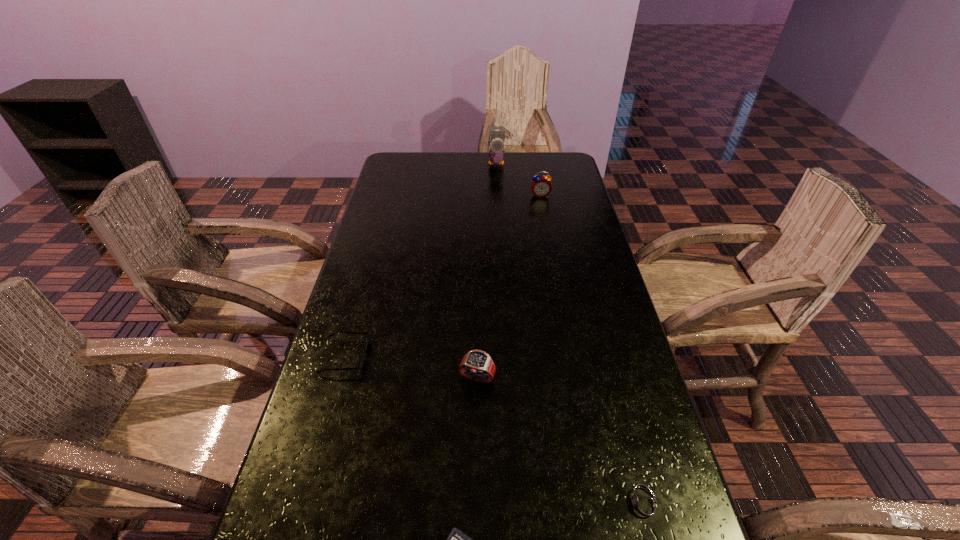
The height and width of the screenshot is (540, 960). Identify the location of watch that is at the right edge. (642, 504).

Find the location of a particular element. This screenshot has height=540, width=960. vacant point at the far edge is located at coordinates (513, 172).

Locate an element on the screen. The image size is (960, 540). free spot at the left edge of the desktop is located at coordinates (402, 273).

Find the location of a particular element. This screenshot has width=960, height=540. free location at the right edge of the desktop is located at coordinates (607, 531).

At what (x,y) coordinates should I click in order to perform the action: click on vacant space at the far right corner of the desktop. Please return your answer as a coordinate pair (x, y). Looking at the image, I should click on (552, 174).

Find the location of a particular element. This screenshot has width=960, height=540. free point between the leftmost object and the fifth nearest object is located at coordinates (443, 275).

The width and height of the screenshot is (960, 540). What are the coordinates of `empty location between the second tallest object and the fourth tallest object` in the screenshot? It's located at (443, 275).

Where is `free space between the nearer watch and the tallest object`? This screenshot has height=540, width=960. free space between the nearer watch and the tallest object is located at coordinates (570, 334).

Image resolution: width=960 pixels, height=540 pixels. I want to click on vacant region between the fourth shortest object and the alarm clock, so click(509, 287).

Locate an element on the screen. Image resolution: width=960 pixels, height=540 pixels. vacant region between the alarm clock and the left watch is located at coordinates (509, 287).